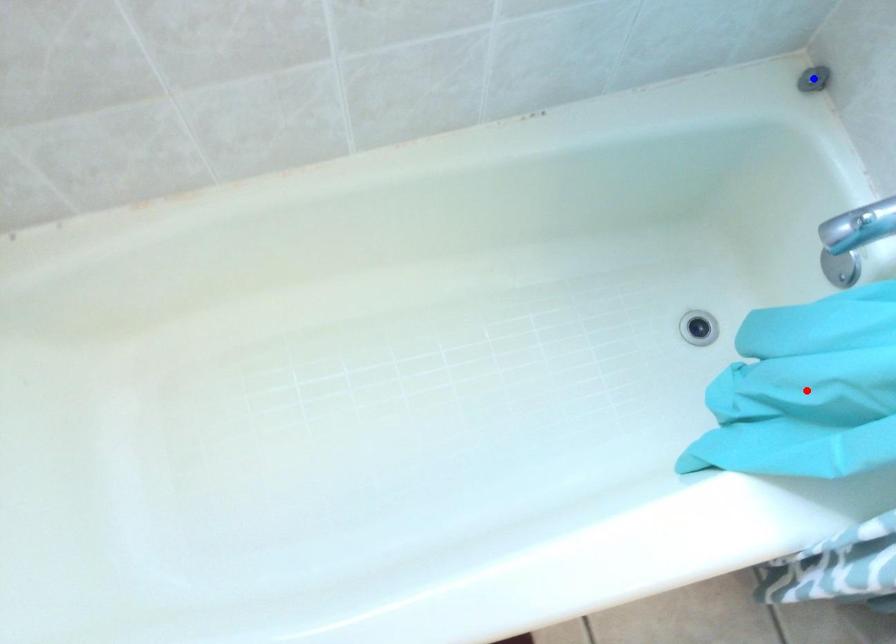
Question: Two points are marked on the image. Which point is closer to the camera?

Choices:
 (A) Blue point is closer.
 (B) Red point is closer.

Answer: (B)